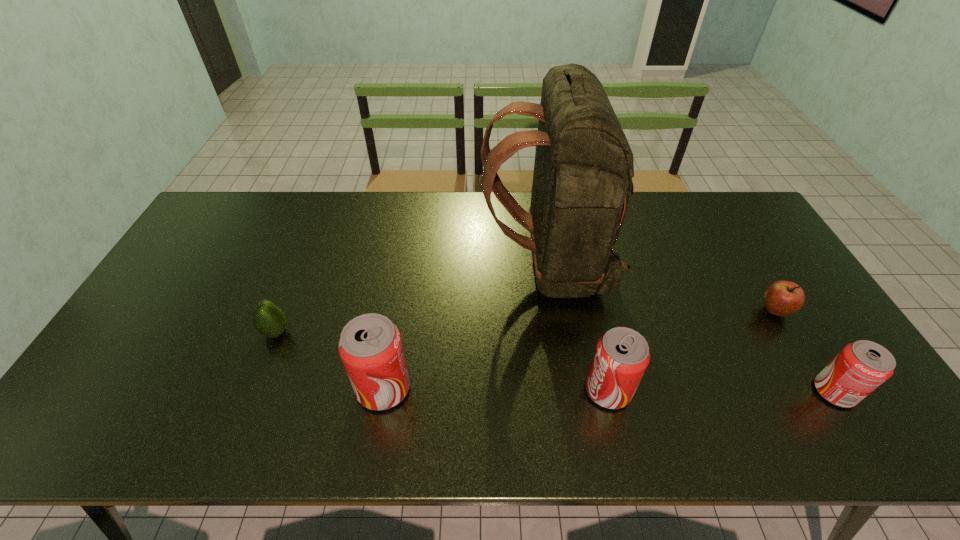
Locate an element on the screen. free space that satisfies the following two spatial constraints: 1. on the back of the tallest object; 2. on the back side of the apple is located at coordinates (554, 311).